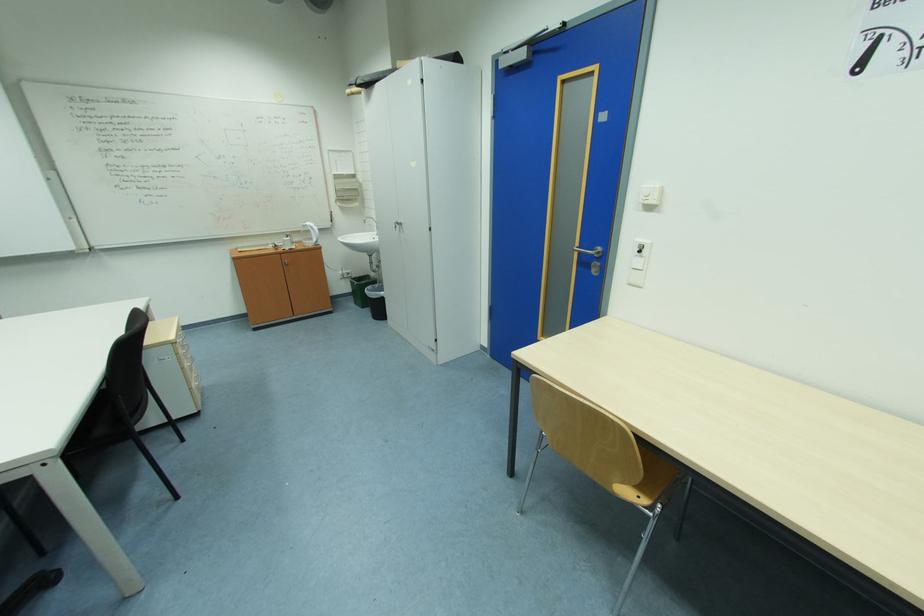
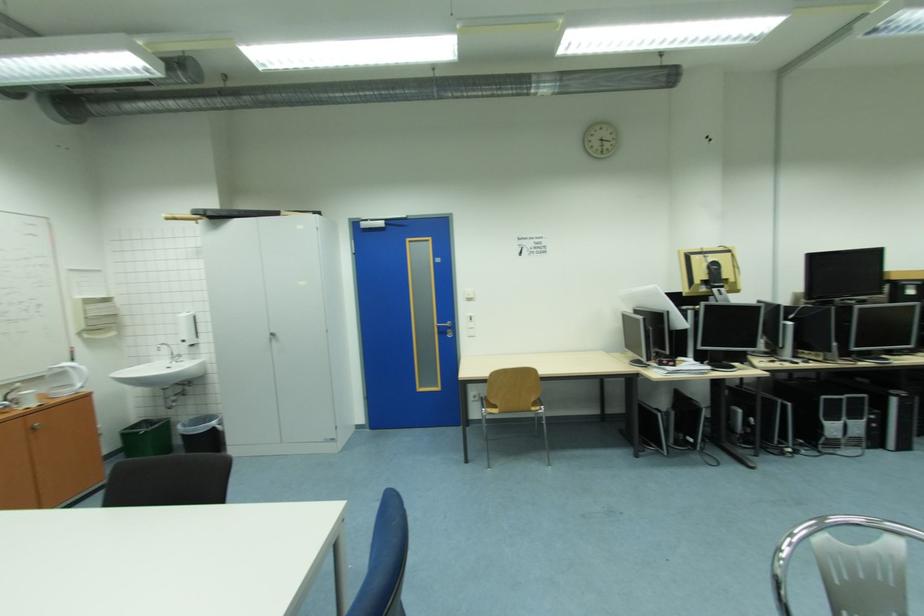
In the second image, find the point that corresponds to (x=344, y=177) in the first image.

(94, 302)